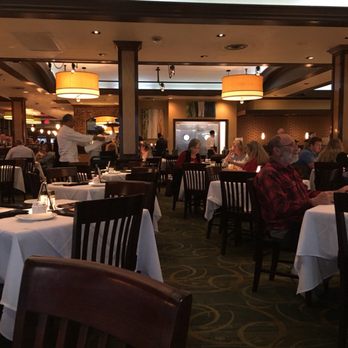
Identify the location of white tablecloth. (60, 234), (70, 192), (111, 176), (214, 194), (183, 190), (316, 238).